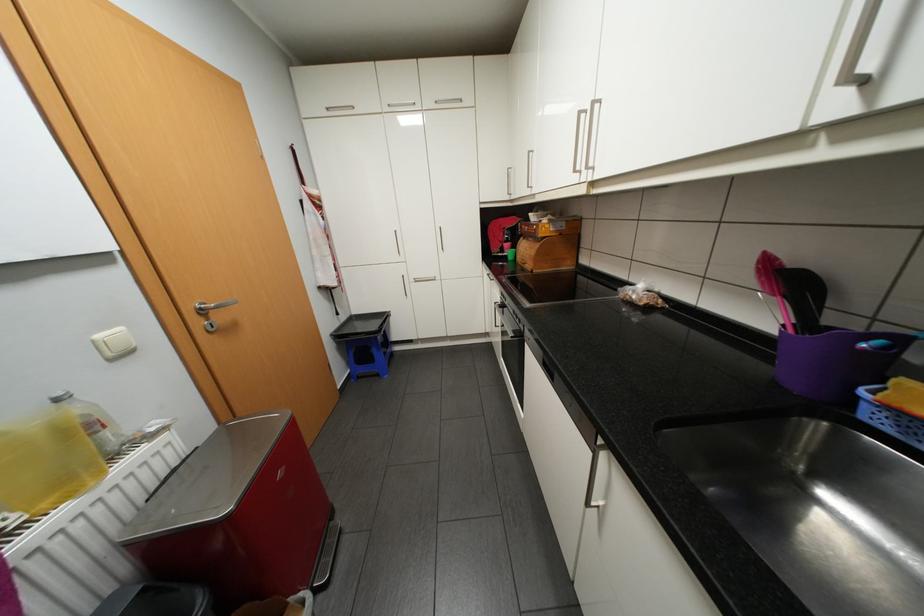
Where would you press the white light switch? Please return your answer as a coordinate pair (x, y).

(114, 342)